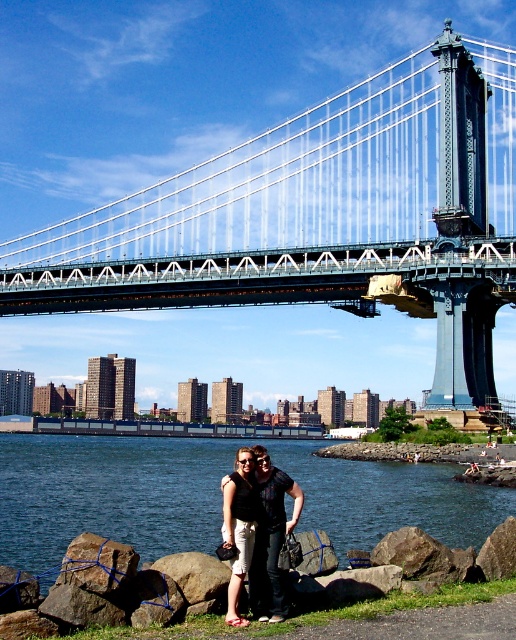
Which of these two, blue water at lower left or smooth gray rock at lower center, stands taller?

With more height is blue water at lower left.

Looking at this image, who is higher up, blue water at lower left or smooth gray rock at lower center?

blue water at lower left is higher up.

Who is more distant from viewer, (509, 513) or (153, 566)?

The point (509, 513) is behind.

What are the coordinates of `blue water at lower left` in the screenshot? It's located at (108, 493).

Can you confirm if metallic gray suspension bridge at center is positioned to the right of matte black shorts at center?

Yes, metallic gray suspension bridge at center is to the right of matte black shorts at center.

Does metallic gray suspension bridge at center have a greater height compared to matte black shorts at center?

Yes, metallic gray suspension bridge at center is taller than matte black shorts at center.

Which is in front, point (410, 72) or point (235, 563)?

Point (235, 563)

Where is `metallic gray suspension bridge at center`? Image resolution: width=516 pixels, height=640 pixels. metallic gray suspension bridge at center is located at coordinates (322, 218).

Is metallic gray suspension bridge at center below smooth gray rock at lower center?

No.

Can you confirm if metallic gray suspension bridge at center is bigger than smooth gray rock at lower center?

Correct, metallic gray suspension bridge at center is larger in size than smooth gray rock at lower center.

The height and width of the screenshot is (640, 516). What do you see at coordinates (322, 218) in the screenshot? I see `metallic gray suspension bridge at center` at bounding box center [322, 218].

The width and height of the screenshot is (516, 640). I want to click on metallic gray suspension bridge at center, so click(322, 218).